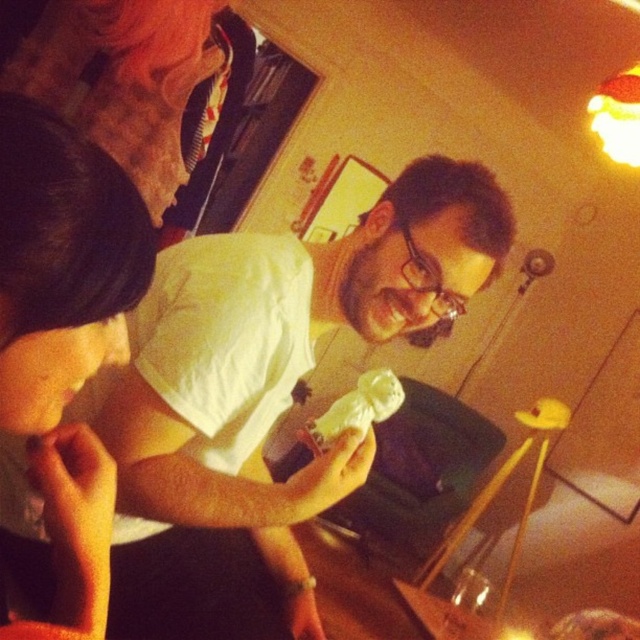
Question: Considering the real-world distances, which object is closest to the white fluffy cloud at center?

Choices:
 (A) white matte shirt at center
 (B) matte white shirt at upper left

Answer: (A)

Question: Which point is farther to the camera?

Choices:
 (A) (157, 516)
 (B) (323, 413)

Answer: (B)

Question: Is white matte shirt at center below matte white shirt at upper left?

Choices:
 (A) no
 (B) yes

Answer: (B)

Question: Where is white matte shirt at center located in relation to white fluffy cloud at center in the image?

Choices:
 (A) left
 (B) right

Answer: (A)

Question: Is white matte shirt at center in front of matte white shirt at upper left?

Choices:
 (A) yes
 (B) no

Answer: (B)

Question: Which point is farther to the camera?

Choices:
 (A) white matte shirt at center
 (B) matte white shirt at upper left

Answer: (A)